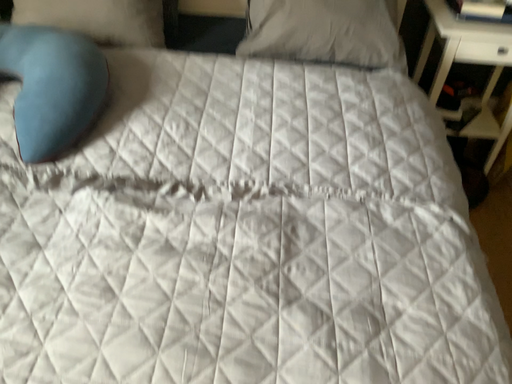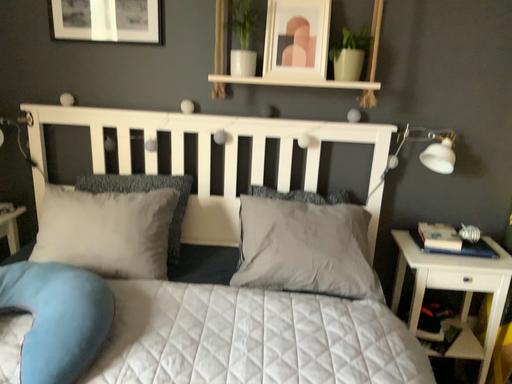
Question: How did the camera likely rotate when shooting the video?

Choices:
 (A) rotated upward
 (B) rotated downward

Answer: (A)